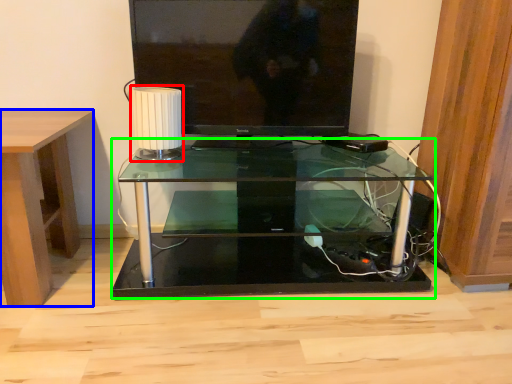
Question: Which is nearer to the lamp (highlighted by a red box)? desk (highlighted by a blue box) or table (highlighted by a green box).

Choices:
 (A) desk
 (B) table

Answer: (A)